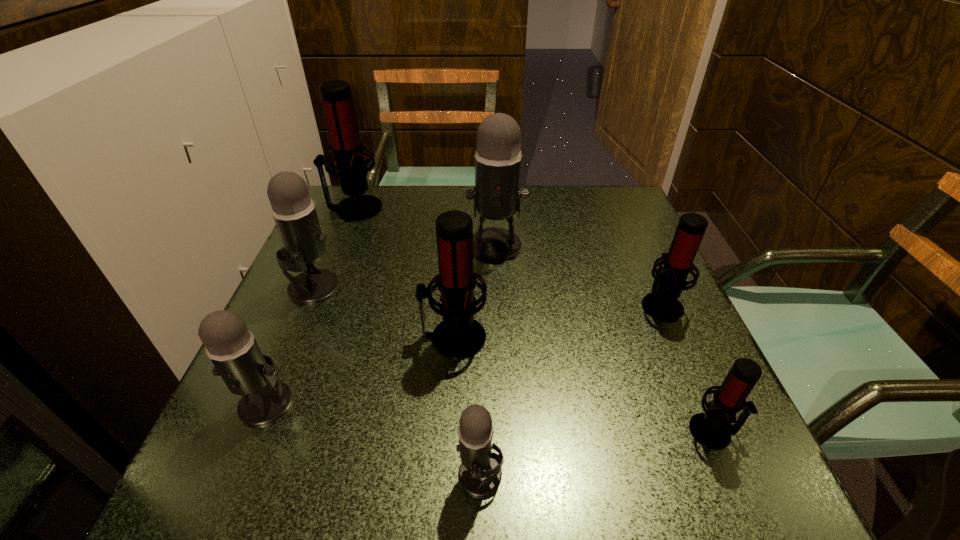
At what (x,y) coordinates should I click in order to perform the action: click on the farthest object. Please return your answer as a coordinate pair (x, y). Looking at the image, I should click on (336, 95).

Where is `the leftmost red microphone`? Image resolution: width=960 pixels, height=540 pixels. the leftmost red microphone is located at coordinates (336, 95).

Locate an element on the screen. the farthest gray microphone is located at coordinates (496, 194).

Where is `the second farthest microphone`? the second farthest microphone is located at coordinates (496, 194).

This screenshot has width=960, height=540. In order to click on the second biggest gray microphone in this screenshot , I will do `click(293, 210)`.

Locate an element on the screen. the second biggest red microphone is located at coordinates (458, 336).

The width and height of the screenshot is (960, 540). In order to click on the second smallest red microphone in this screenshot , I will do `click(662, 304)`.

The width and height of the screenshot is (960, 540). Identify the location of the second smallest gray microphone. (231, 346).

The height and width of the screenshot is (540, 960). Find the location of `the smallest red microphone`. the smallest red microphone is located at coordinates (712, 429).

Locate an element on the screen. This screenshot has width=960, height=540. the nearest object is located at coordinates pos(480,474).